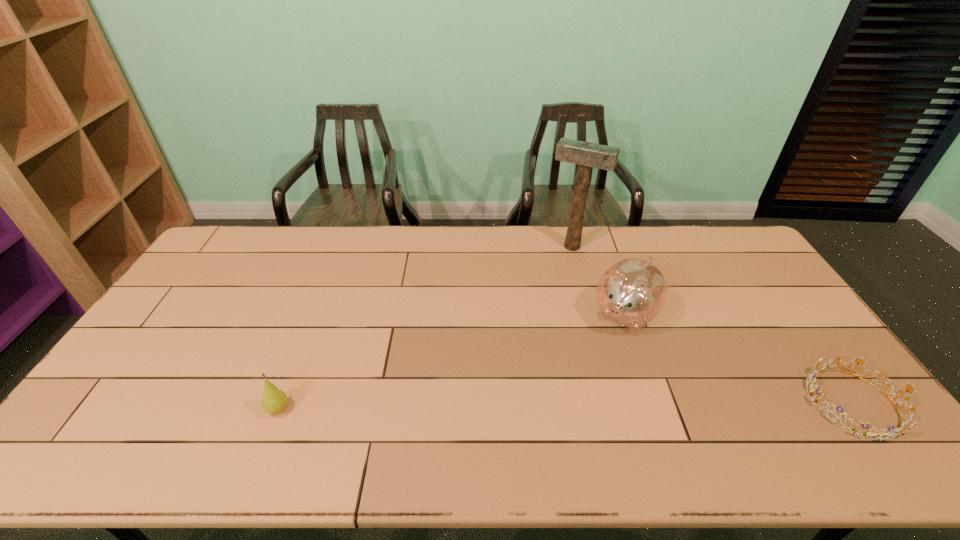
This screenshot has height=540, width=960. I want to click on vacant space that satisfies the following two spatial constraints: 1. on the front side of the shortest object; 2. on the front-facing side of the farthest object, so click(x=612, y=402).

At what (x,y) coordinates should I click in order to perform the action: click on vacant space that satisfies the following two spatial constraints: 1. on the front side of the tallest object; 2. on the front-facing side of the rightmost object. Please return your answer as a coordinate pair (x, y). This screenshot has height=540, width=960. Looking at the image, I should click on (612, 402).

Where is `vacant space that satisfies the following two spatial constraints: 1. on the back side of the leftmost object; 2. on the right side of the piggy bank`? vacant space that satisfies the following two spatial constraints: 1. on the back side of the leftmost object; 2. on the right side of the piggy bank is located at coordinates (315, 315).